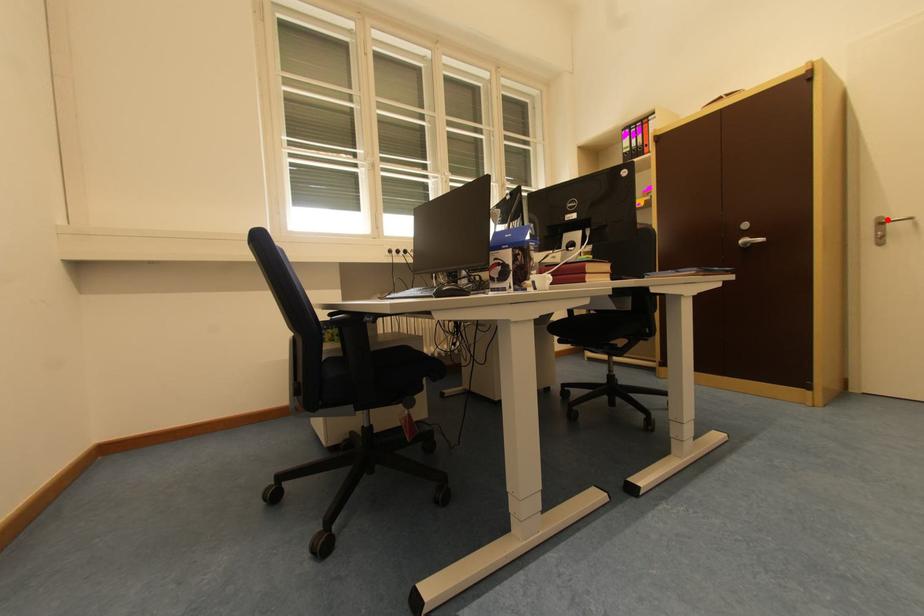
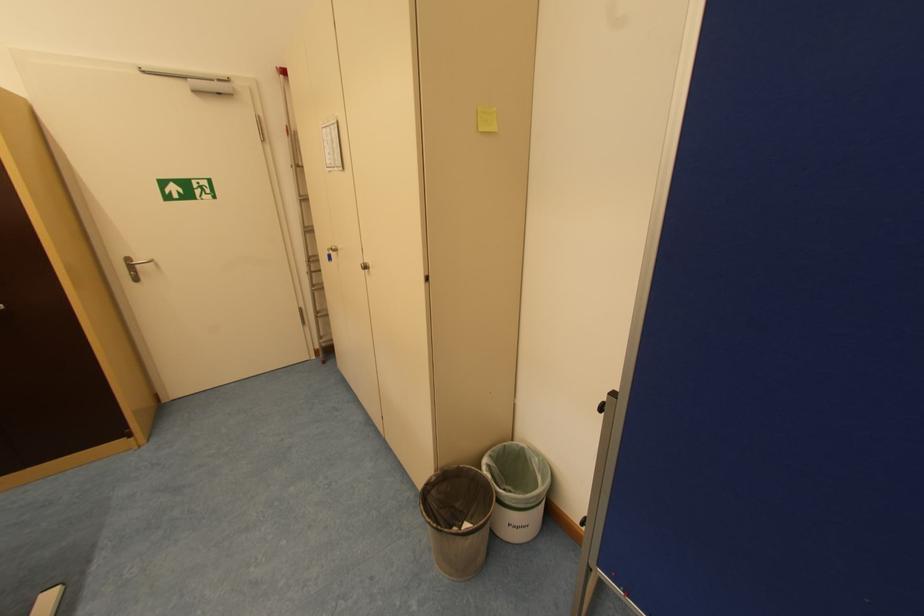
Where in the second image is the point corresponding to the highlighted location from the first image?

(135, 261)